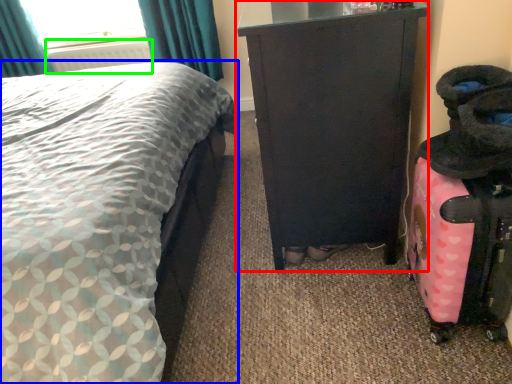
Question: Which is nearer to the furniture (highlighted by a red box)? bed (highlighted by a blue box) or radiator (highlighted by a green box).

Choices:
 (A) bed
 (B) radiator

Answer: (A)